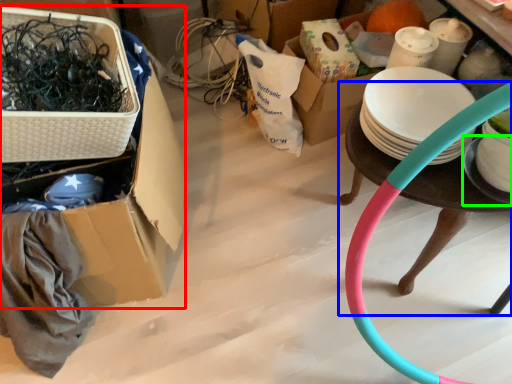
Question: Considering the real-world distances, which object is farthest from box (highlighted by a red box)? table (highlighted by a blue box) or plate (highlighted by a green box)?

Choices:
 (A) table
 (B) plate

Answer: (B)